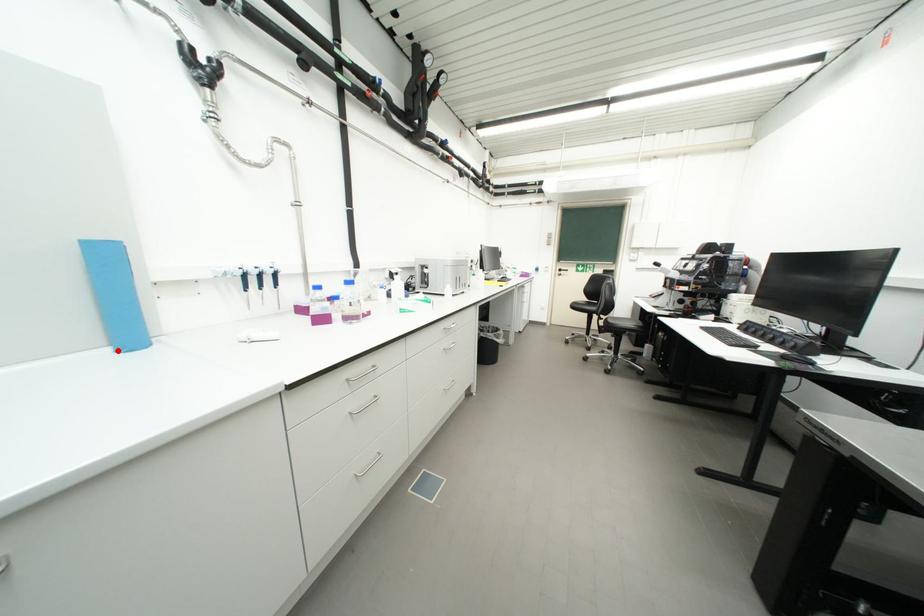
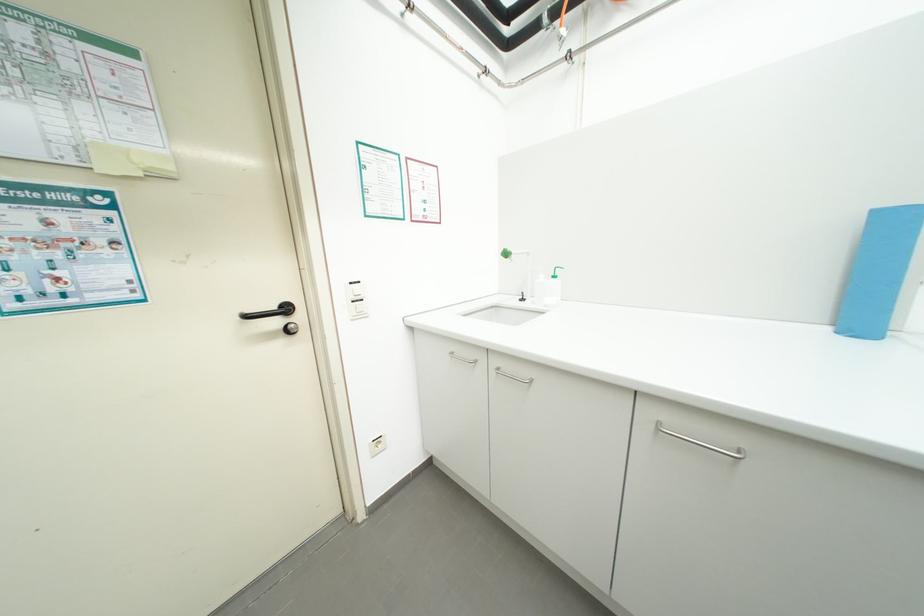
Locate, in the second image, the point that corresponds to the highlighted location in the first image.

(835, 330)